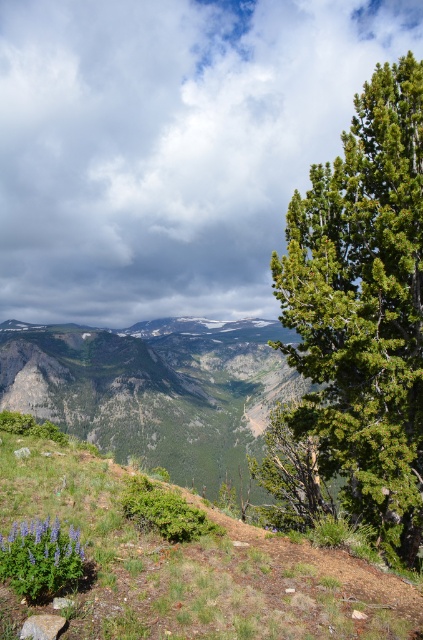
From the picture: You are an artist planning to paint this mountain view. You want to ensure the green textured tree at right and the purple matte flower at lower left are proportionally accurate. Which object should you make wider in your painting?

The green textured tree at right should be made wider in the painting since its width is larger than the purple matte flower at lower left.

You are a hiker who wants to place a 3 meter long tent between the green grassy at lower left and the purple matte flower at lower left. Can you fit the tent in that space?

The distance between the green grassy at lower left and the purple matte flower at lower left is 2.77 meters. Since the tent is 3 meters long, it will not fit in the space between them.

You are a hiker who wants to take a photo of the green grassy at lower left from the green textured tree at right. Is the tree positioned in a way that you can see the grassy area from there?

The green textured tree at right is located above green grassy at lower left, so yes, you can see the green grassy at lower left from the tree.